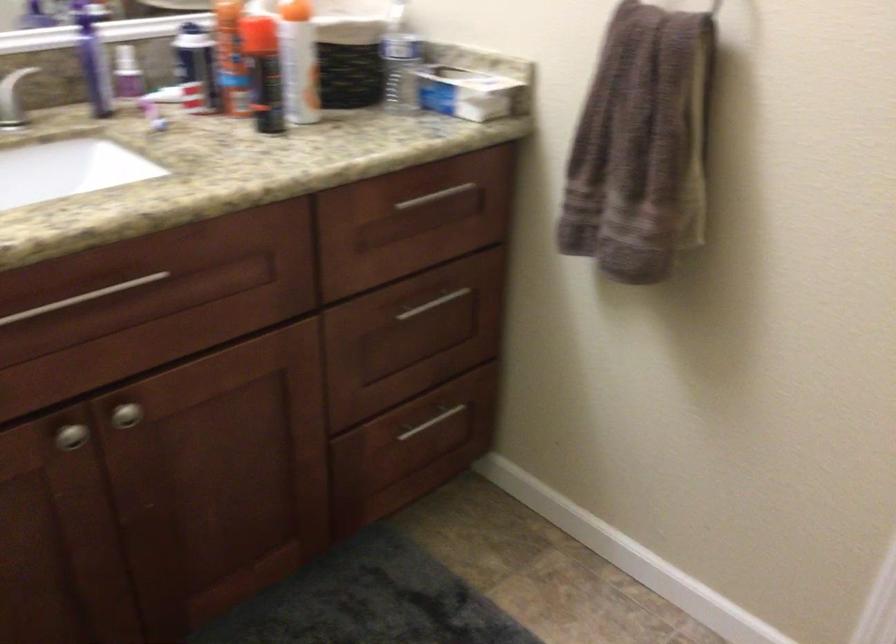
What do you see at coordinates (401, 71) in the screenshot? Image resolution: width=896 pixels, height=644 pixels. I see `a plastic water bottle` at bounding box center [401, 71].